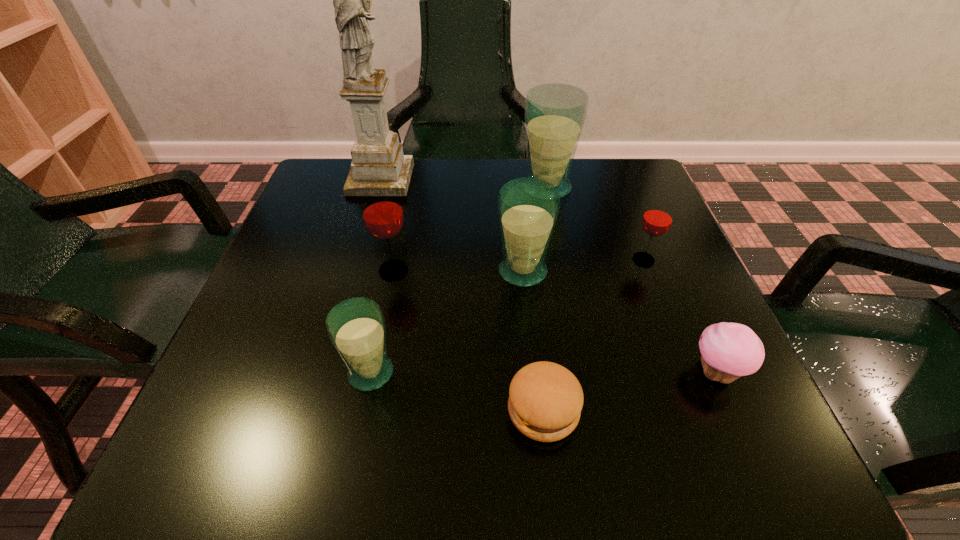
This screenshot has width=960, height=540. I want to click on blank space that satisfies the following two spatial constraints: 1. on the front-facing side of the nearest glass; 2. on the left side of the sculpture, so click(325, 373).

Where is `vacant space that satisfies the following two spatial constraints: 1. on the back side of the rightmost glass; 2. on the right side of the hamburger`? vacant space that satisfies the following two spatial constraints: 1. on the back side of the rightmost glass; 2. on the right side of the hamburger is located at coordinates (527, 260).

This screenshot has height=540, width=960. I want to click on vacant space that satisfies the following two spatial constraints: 1. on the front-facing side of the sculpture; 2. on the left side of the nearest glass, so click(x=325, y=373).